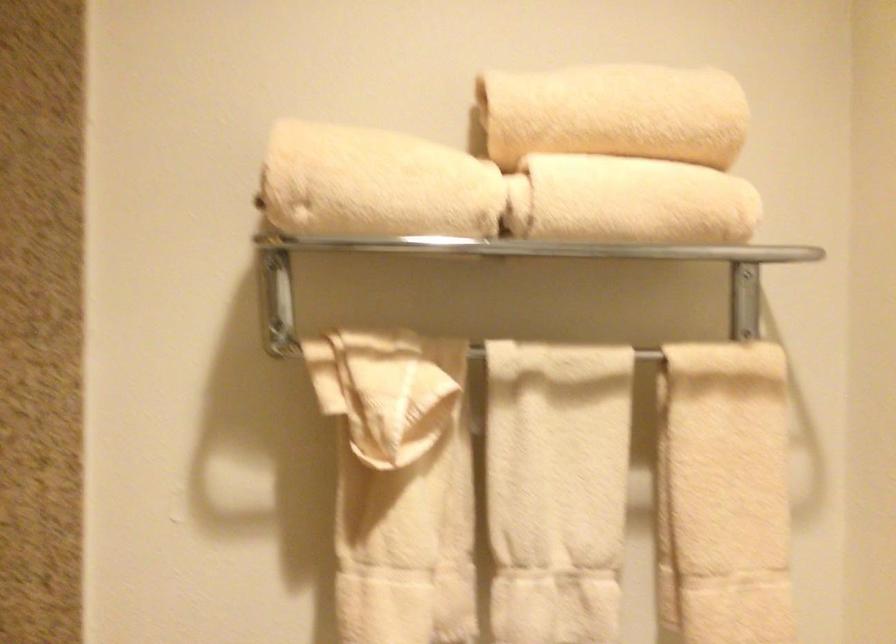
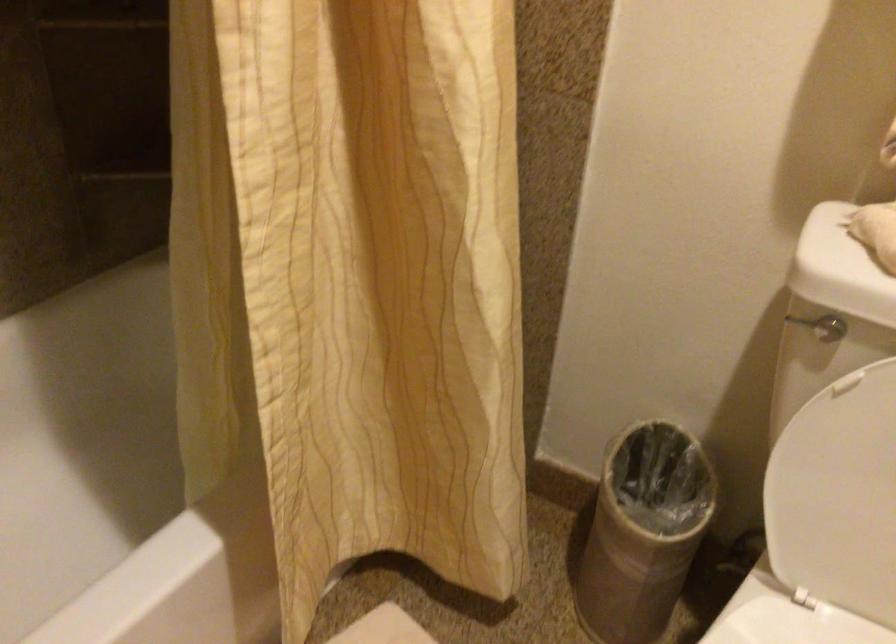
Based on the continuous images, in which direction is the camera rotating?

The rotation direction of the camera is left-down.